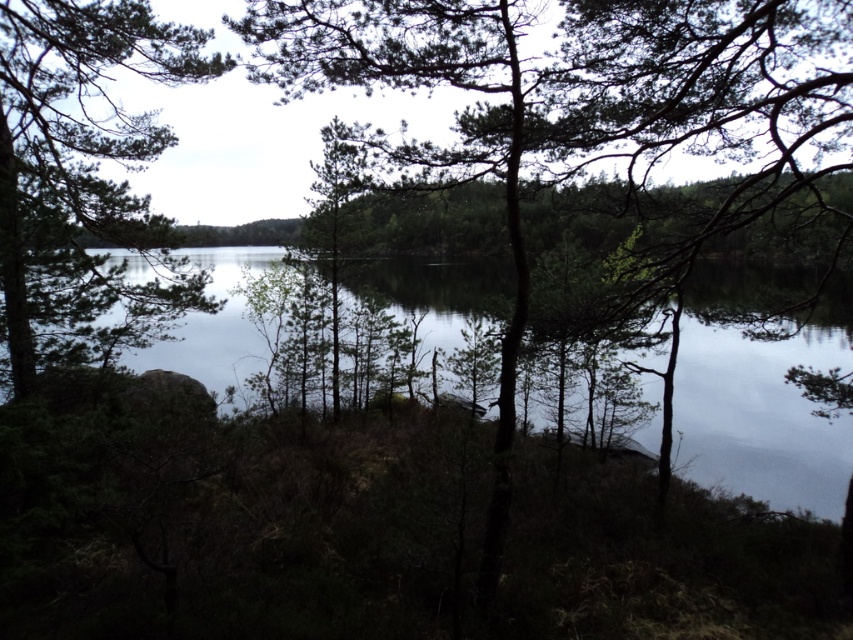
You are a bird flying over the serene natural scene. You want to land on the tallest object between the green matte tree at left and the transparent water at center. Which one should you choose?

The transparent water at center is taller than the green matte tree at left, so you should land on the transparent water at center.

You are an artist trying to paint the scene. You have a limited amount of green paint. The green matte tree at left requires less paint than the transparent water at center. Which object should you paint first to conserve your green paint?

The green matte tree at left requires less green paint because it is thinner than the transparent water at center, so you should paint the green matte tree at left first to conserve your green paint.